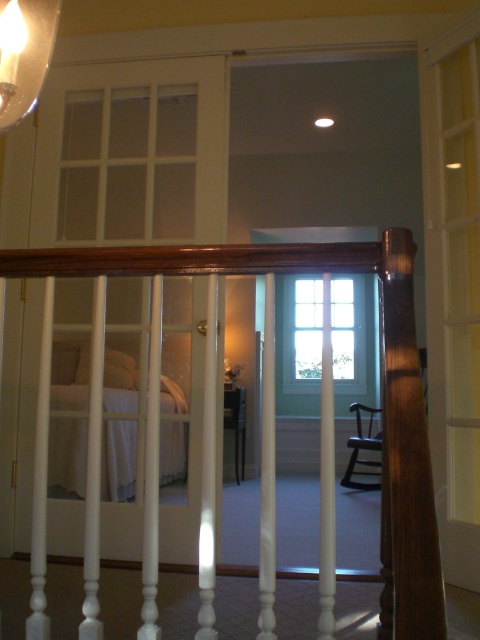
Is wooden handrail at center taller than matte glass lampshade at upper left?

Correct, wooden handrail at center is much taller as matte glass lampshade at upper left.

Is point (160, 269) behind point (11, 26)?

That is False.

This screenshot has width=480, height=640. In order to click on wooden handrail at center in this screenshot , I will do `click(384, 387)`.